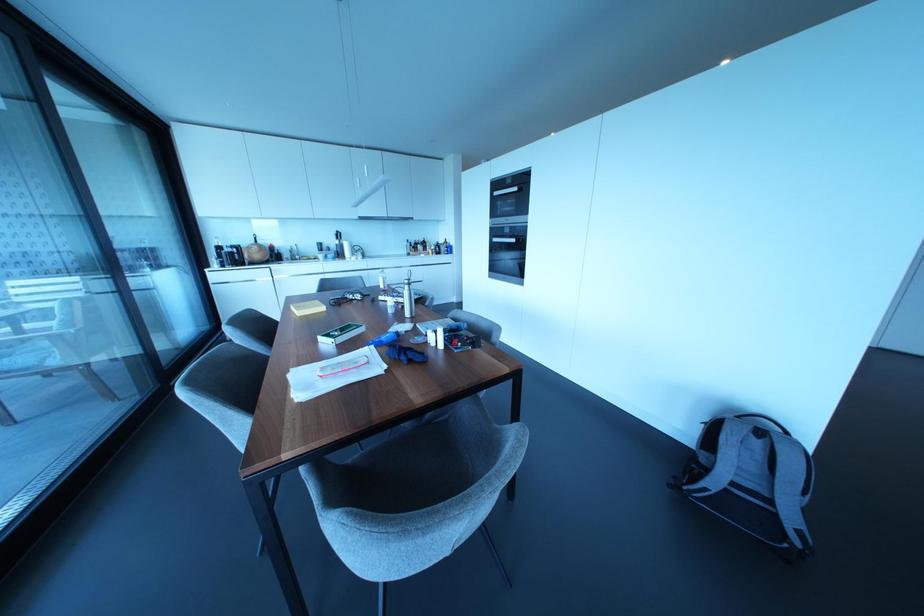
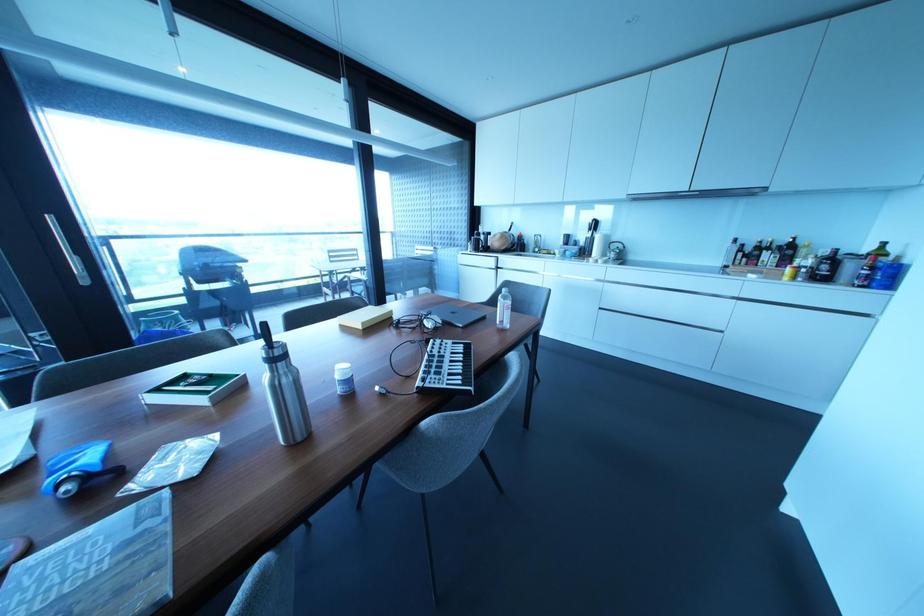
The point at [436,245] is marked in the first image. Where is the corresponding point in the second image?

(833, 257)